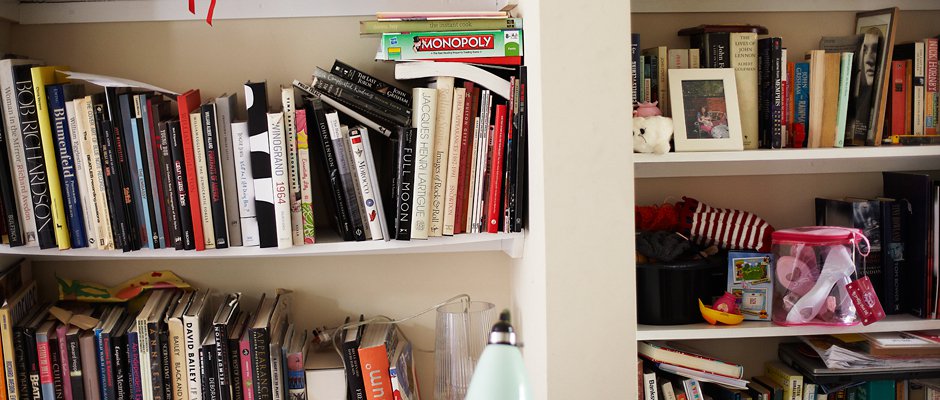
The image size is (940, 400). What are the coordinates of `wainscotting` in the screenshot? It's located at (100, 9), (771, 5).